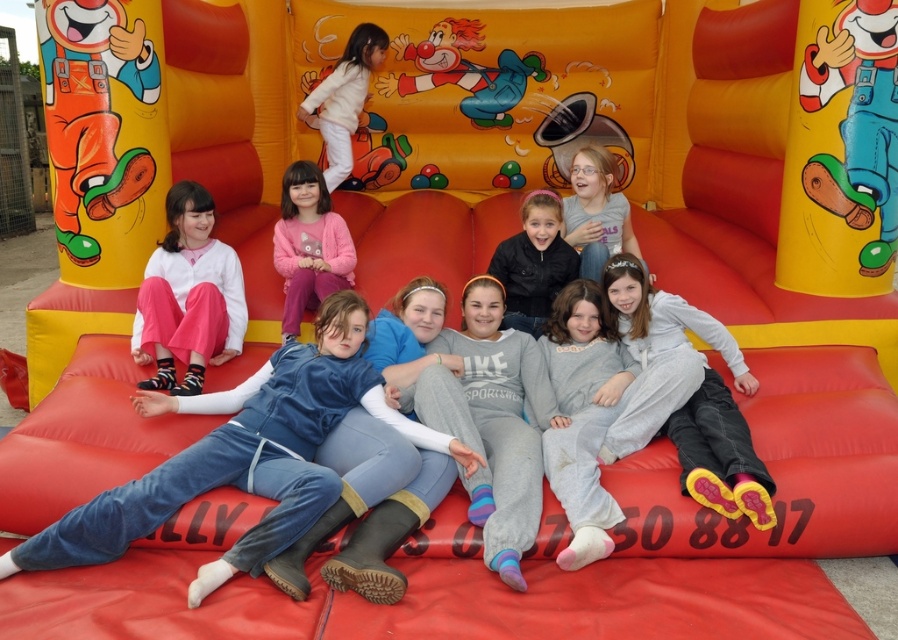
Can you confirm if blue denim pants at lower left is wider than matte pink pants at lower left?

Yes, blue denim pants at lower left is wider than matte pink pants at lower left.

Can you confirm if blue denim pants at lower left is shorter than matte pink pants at lower left?

In fact, blue denim pants at lower left may be taller than matte pink pants at lower left.

Between point (295, 563) and point (221, 323), which one is positioned in front?

Positioned in front is point (295, 563).

Locate an element on the screen. This screenshot has width=898, height=640. blue denim pants at lower left is located at coordinates (348, 472).

Does light gray fleece pants at center appear on the right side of black matte jacket at center?

Correct, you'll find light gray fleece pants at center to the right of black matte jacket at center.

Can you confirm if light gray fleece pants at center is smaller than black matte jacket at center?

No, light gray fleece pants at center is not smaller than black matte jacket at center.

Which is in front, point (609, 317) or point (558, 273)?

Point (609, 317) is in front.

Locate an element on the screen. light gray fleece pants at center is located at coordinates (720, 454).

Which is behind, point (216, 301) or point (341, 179)?

The point (341, 179) is behind.

Can you confirm if matte pink pants at lower left is positioned to the right of white fluffy cloud at upper center?

No, matte pink pants at lower left is not to the right of white fluffy cloud at upper center.

At what (x,y) coordinates should I click in order to perform the action: click on matte pink pants at lower left. Please return your answer as a coordinate pair (x, y). Looking at the image, I should click on click(x=188, y=296).